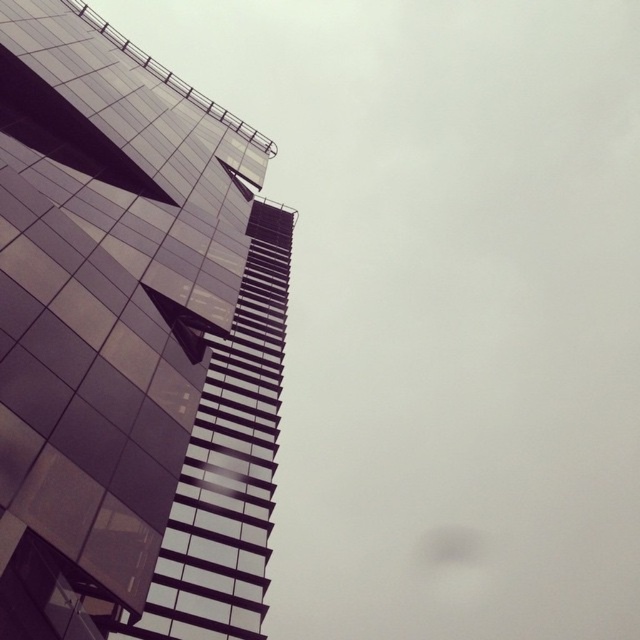
You are an architect analyzing the building layout. Which of the two structures, the reflective glass building at left or the reflective glass tower at upper left, has a greater height?

The reflective glass building at left is taller than the reflective glass tower at upper left.

You are standing at the center of the image and want to locate the reflective glass building at left. According to its coordinates, in which direction should you look to find it?

The reflective glass building at left is located at coordinates point (131, 340), so you should look to the left side of the image.

You are standing in front of the modern building and want to take a photo. There are two points marked on the building facade at coordinates point (125, 634) and point (218, 618). Which point is closer to your camera when taking the photo?

Point (125, 634) is closer to the camera than point (218, 618).